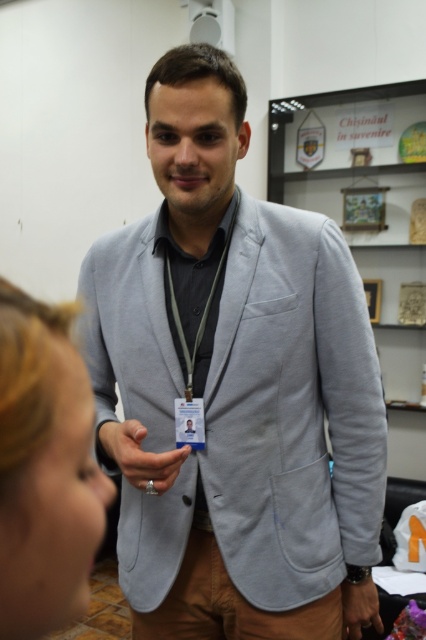
Question: Is light gray cotton blazer at center further to camera compared to matte silver ring at lower center?

Choices:
 (A) no
 (B) yes

Answer: (A)

Question: From the image, what is the correct spatial relationship of blonde hair at lower left in relation to matte silver ring at lower center?

Choices:
 (A) above
 (B) below

Answer: (A)

Question: Which point is closer to the camera?

Choices:
 (A) (146, 486)
 (B) (342, 282)
 (C) (380, 621)

Answer: (A)

Question: Does blonde hair at lower left appear on the right side of silver metallic ring at center?

Choices:
 (A) yes
 (B) no

Answer: (A)

Question: Estimate the real-world distances between objects in this image. Which object is closer to the green fabric lanyard at center?

Choices:
 (A) light gray cotton blazer at center
 (B) matte silver ring at lower center
 (C) blonde hair at lower left
 (D) silver metallic ring at center

Answer: (D)

Question: Which object is positioned closest to the green fabric lanyard at center?

Choices:
 (A) silver metallic ring at center
 (B) matte silver ring at lower center
 (C) light gray cotton blazer at center
 (D) blonde hair at lower left

Answer: (A)